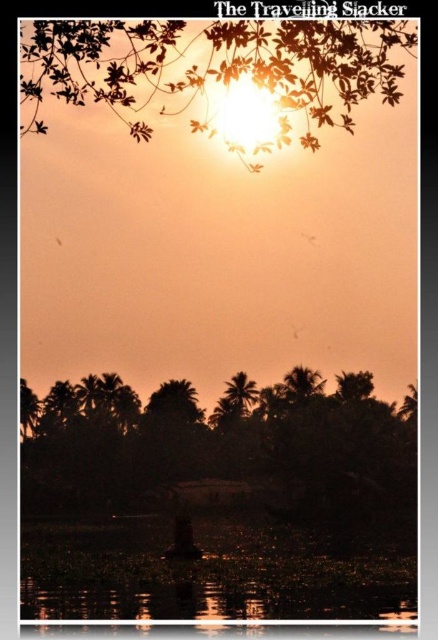
You are an artist trying to paint the sunset scene. You notice the silhouette palm trees at lower center and the silhouette leafy branch at upper center. Which object appears shorter in the painting?

The silhouette palm trees at lower center appears shorter compared to the silhouette leafy branch at upper center.

You are standing at the edge of the water and see the silhouette palm trees at lower center and the translucent dark water at lower center. Which object is closer to your right side?

The silhouette palm trees at lower center are closer to your right side because they are positioned to the right of the translucent dark water at lower center.